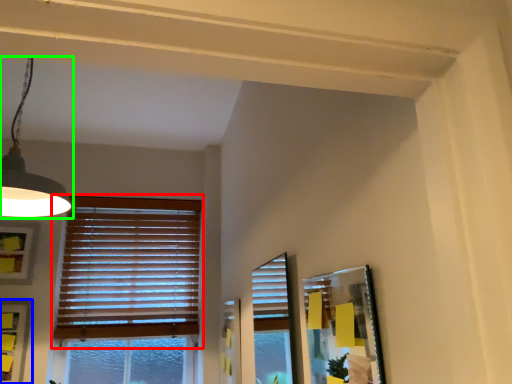
Question: Based on their relative distances, which object is nearer to window blind (highlighted by a red box)? Choose from picture frame (highlighted by a blue box) and lamp (highlighted by a green box).

Choices:
 (A) picture frame
 (B) lamp

Answer: (A)